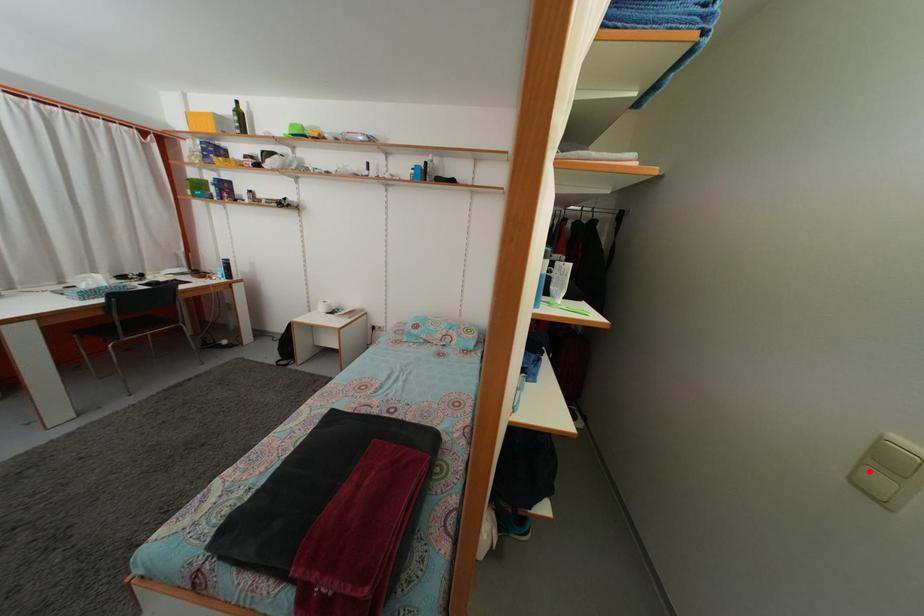
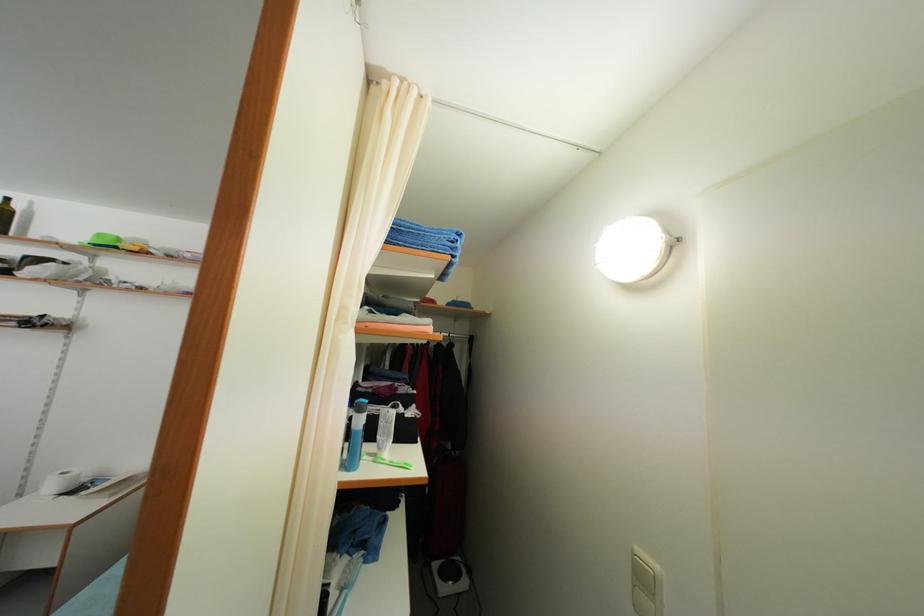
In the second image, find the point that corresponds to the highlighted location in the first image.

(639, 593)